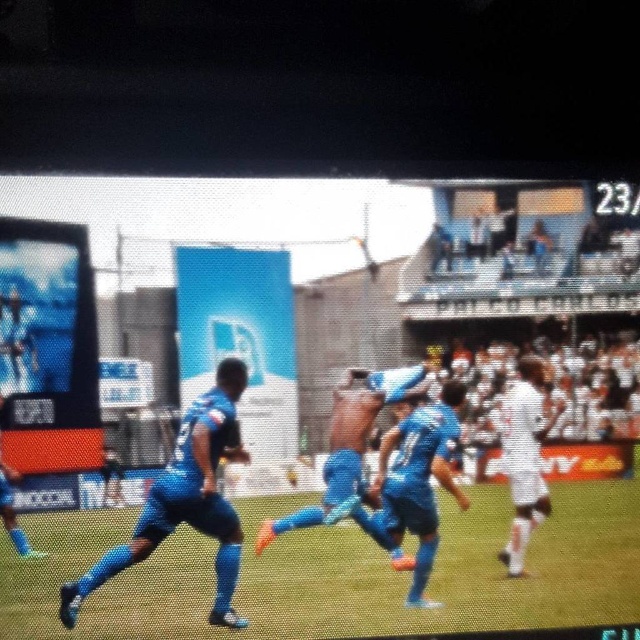
You are a soccer fan watching the game on TV. You want to locate the player wearing the blue fabric jersey at center. Where should you look on the screen?

The blue fabric jersey at center is located at point coordinates (340, 525) on the screen.

You are a soccer coach analyzing a video feed of the match. You notice the blue fabric shirt at center on the field. Based on its position, can you determine if it is closer to the left or right side of the screen?

The blue fabric shirt at center is located at point coordinates 0.714 on the x axis, which places it closer to the right side of the screen since 0.714 is closer to 1.0 than 0.0.